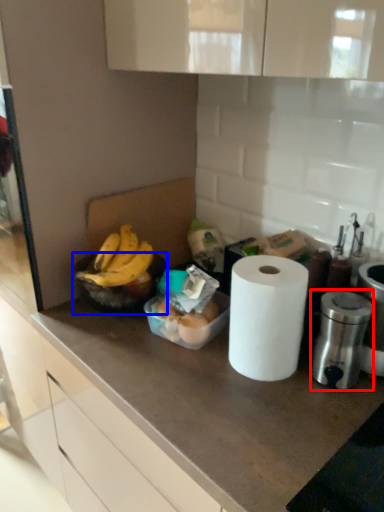
Question: Which of the following is the farthest to the observer, appliance (highlighted by a red box) or bowl (highlighted by a blue box)?

Choices:
 (A) appliance
 (B) bowl

Answer: (B)